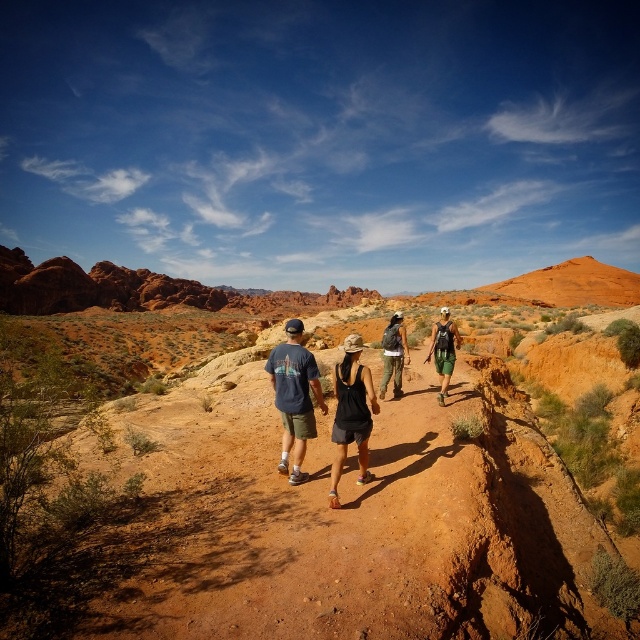
Does dark blue t-shirt at center appear on the left side of green camouflage pants at center?

Indeed, dark blue t-shirt at center is positioned on the left side of green camouflage pants at center.

Does dark blue t-shirt at center have a smaller size compared to green camouflage pants at center?

Actually, dark blue t-shirt at center might be larger than green camouflage pants at center.

The image size is (640, 640). What do you see at coordinates (294, 396) in the screenshot? I see `dark blue t-shirt at center` at bounding box center [294, 396].

The image size is (640, 640). Find the location of `dark blue t-shirt at center`. dark blue t-shirt at center is located at coordinates (294, 396).

Is green fabric shorts at center closer to camera compared to green camouflage pants at center?

Yes, it is.

Which is behind, point (444, 307) or point (394, 316)?

Point (444, 307)

Locate an element on the screen. The image size is (640, 640). green fabric shorts at center is located at coordinates (444, 349).

Can you confirm if dark blue t-shirt at center is positioned to the left of black fabric tank top at center?

Indeed, dark blue t-shirt at center is positioned on the left side of black fabric tank top at center.

The image size is (640, 640). I want to click on dark blue t-shirt at center, so click(x=294, y=396).

Locate an element on the screen. dark blue t-shirt at center is located at coordinates (294, 396).